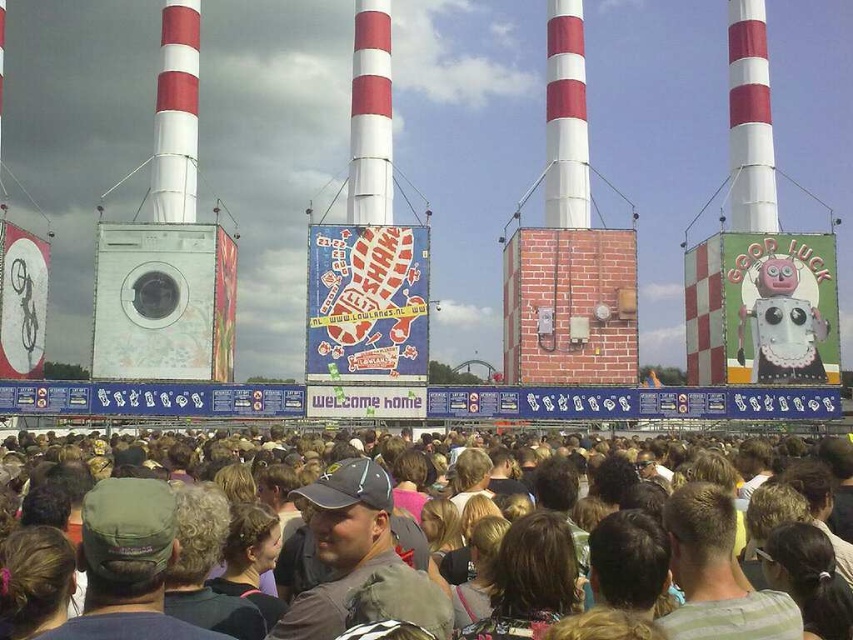
Consider the image. Is dark gray fabric cap at center in front of red and white striped rocket at center?

Yes, it is.

Is point (315, 600) in front of point (378, 170)?

Yes, point (315, 600) is closer to viewer.

Based on the photo, who is more forward, (364, 524) or (361, 36)?

Point (364, 524) is in front.

The width and height of the screenshot is (853, 640). In order to click on dark gray fabric cap at center in this screenshot , I will do `click(341, 545)`.

Is white matte washing machine at left taller than white striped rocket at upper right?

Indeed, white matte washing machine at left has a greater height compared to white striped rocket at upper right.

How much distance is there between white matte washing machine at left and white striped rocket at upper right?

white matte washing machine at left and white striped rocket at upper right are 83.22 meters apart from each other.

Is point (97, 304) positioned in front of point (759, 196)?

Yes, it is in front of point (759, 196).

Identify the location of white matte washing machine at left. The width and height of the screenshot is (853, 640). (167, 244).

Can you confirm if white striped rocket at upper right is wider than white striped rocket at upper left?

No.

Which of these two, white striped rocket at upper right or white striped rocket at upper left, stands taller?

white striped rocket at upper right is taller.

Is point (746, 70) positioned after point (184, 35)?

Yes.

Where is `white striped rocket at upper right`? This screenshot has height=640, width=853. white striped rocket at upper right is located at coordinates (749, 120).